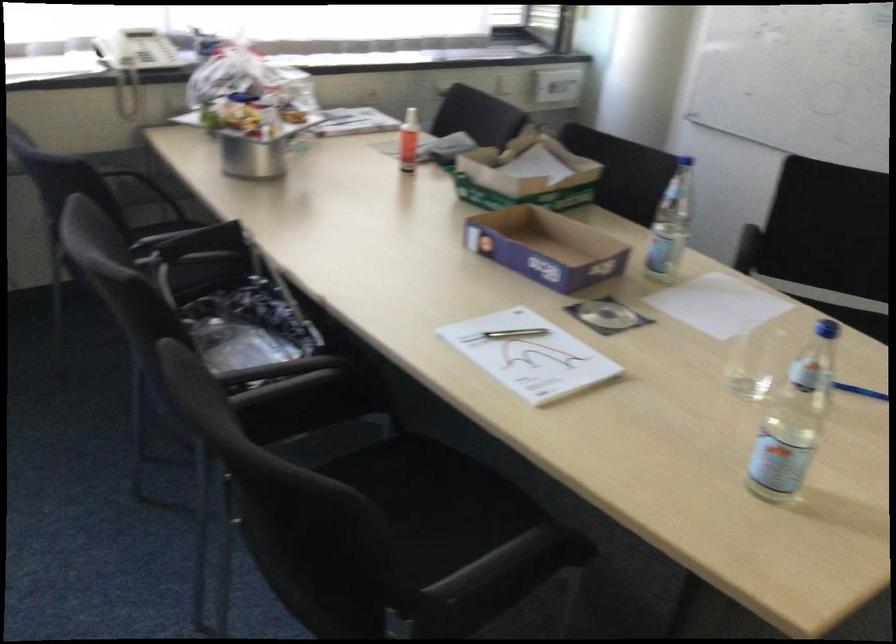
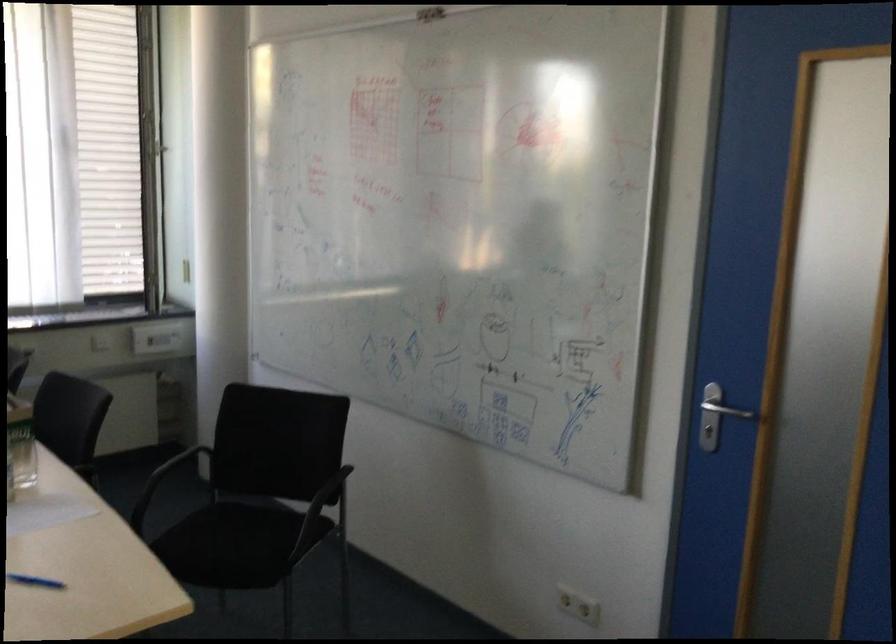
In the second image, find the point that corresponds to (599,204) in the first image.

(21, 444)